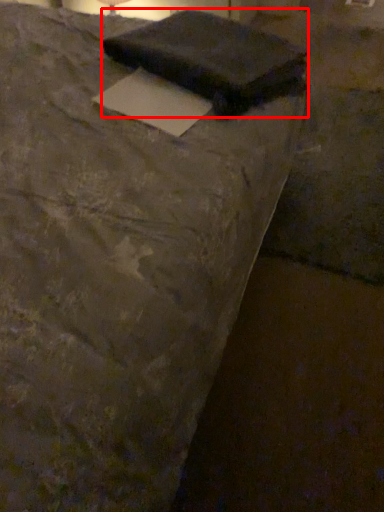
Question: Observing the image, what is the correct spatial positioning of writing (annotated by the red box) in reference to writing?

Choices:
 (A) right
 (B) left

Answer: (A)